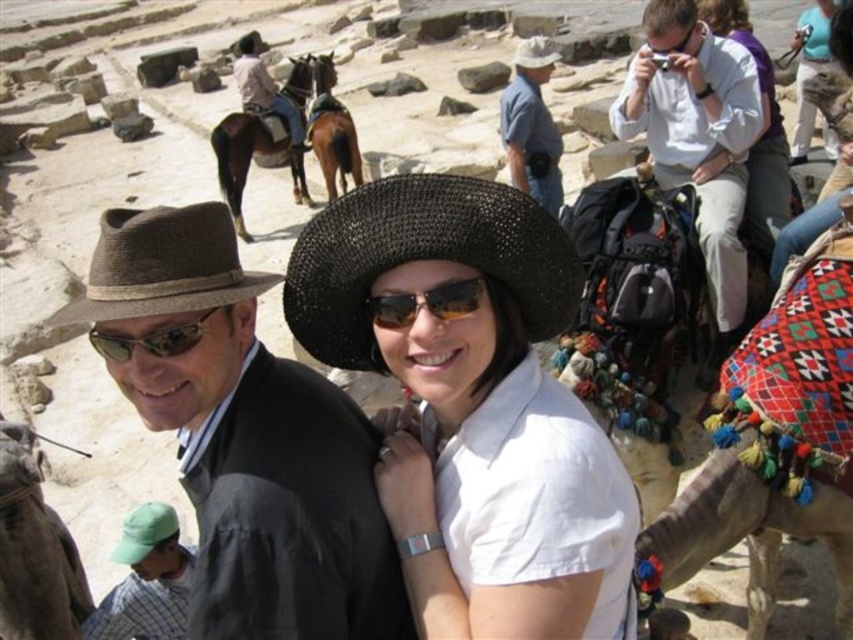
You are taking a photo of the desert scene. You want to focus on the point that is closer to the camera. Which point should you choose between point (338, 316) and point (244, 99)?

Point (338, 316) is closer to the camera than point (244, 99), so you should choose point (338, 316) to focus on.

You are a photographer setting up a wide shot of the desert scene. You need to ensure that both the matte brown fedora at center and the matte black goggles at left are in focus. Given their positions, will the depth of field allow both to be sharp?

The matte brown fedora at center is wider than the matte black goggles at left, so if they are at similar distances from the camera, the depth of field might accommodate both being in focus depending on aperture settings. However, without knowing exact distances or aperture, it is hard to be certain.